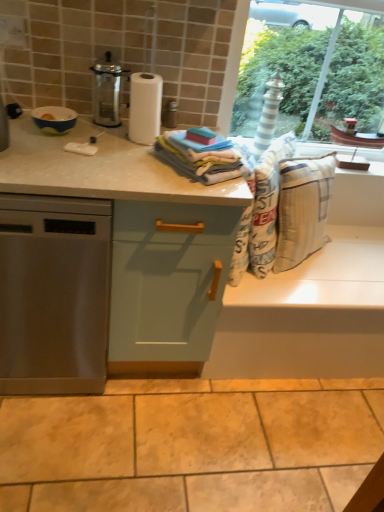
Locate an element on the screen. The height and width of the screenshot is (512, 384). blank space situated above beige marble granite at lower center (from a real-world perspective) is located at coordinates (211, 432).